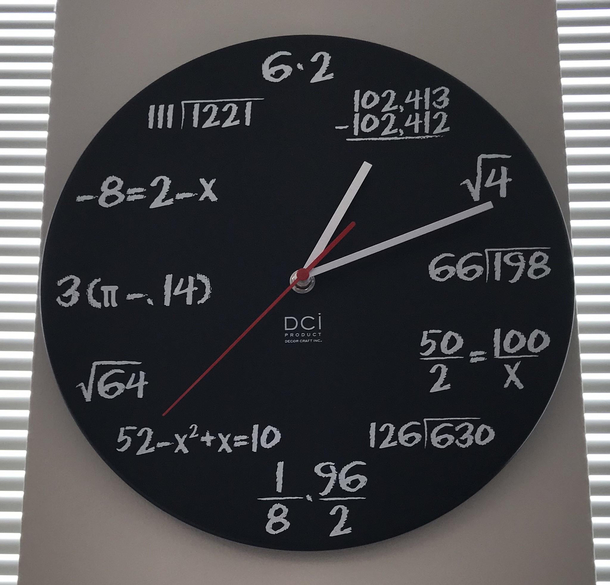
What are the coordinates of `red second hand on clock` in the screenshot? It's located at (299, 275).